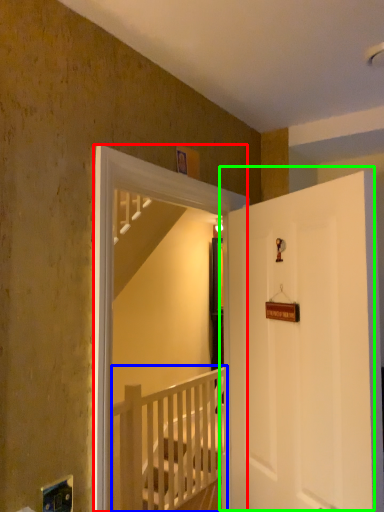
Question: Which object is the farthest from screen door (highlighted by a red box)? Choose among these: rail (highlighted by a blue box) or door (highlighted by a green box).

Choices:
 (A) rail
 (B) door

Answer: (A)